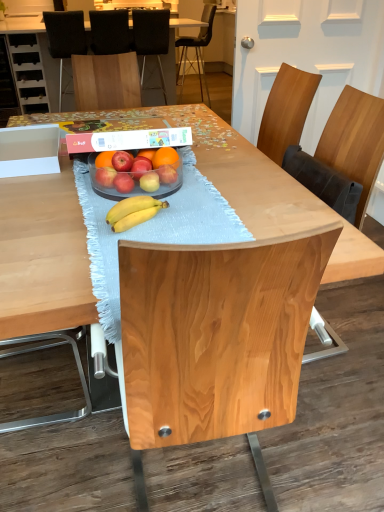
Locate an element on the screen. Image resolution: width=384 pixels, height=512 pixels. free space to the left of matte red apple at center, the 5th apple viewed from the left is located at coordinates (114, 192).